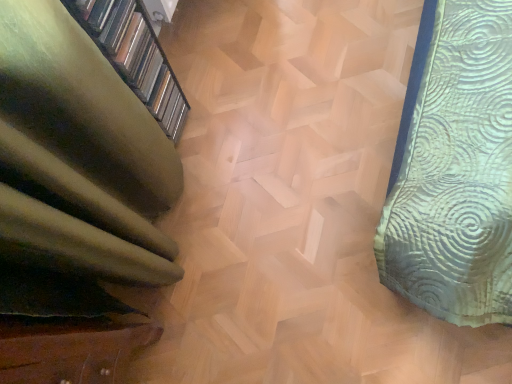
Question: Is green fabric at left in front of or behind wooden staircase at center in the image?

Choices:
 (A) behind
 (B) front

Answer: (B)

Question: From a real-world perspective, is green fabric at left above or below wooden staircase at center?

Choices:
 (A) below
 (B) above

Answer: (B)

Question: Considering the positions of point (123, 76) and point (368, 253), is point (123, 76) closer or farther from the camera than point (368, 253)?

Choices:
 (A) farther
 (B) closer

Answer: (B)

Question: Visually, is wooden staircase at center positioned to the left or to the right of green fabric at left?

Choices:
 (A) right
 (B) left

Answer: (A)

Question: Is wooden staircase at center in front of or behind green fabric at left in the image?

Choices:
 (A) behind
 (B) front

Answer: (A)

Question: From the image's perspective, is wooden staircase at center above or below green fabric at left?

Choices:
 (A) above
 (B) below

Answer: (B)

Question: Is wooden staircase at center inside the boundaries of green fabric at left, or outside?

Choices:
 (A) inside
 (B) outside

Answer: (B)